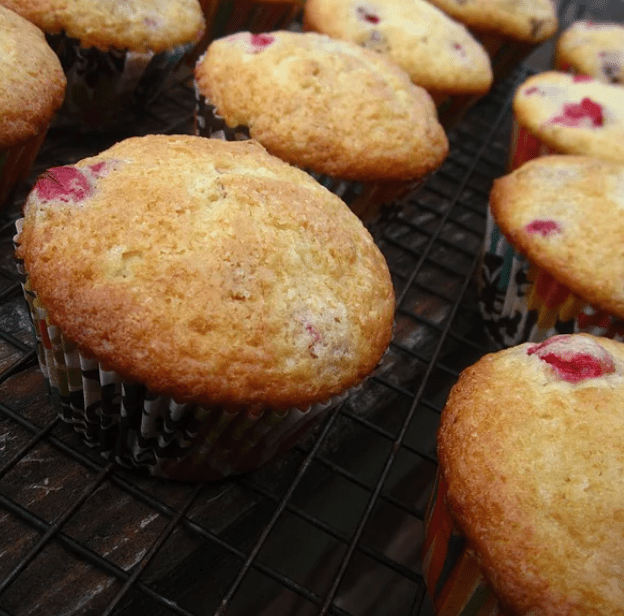
Locate an element on the screen. counter is located at coordinates (130, 537).